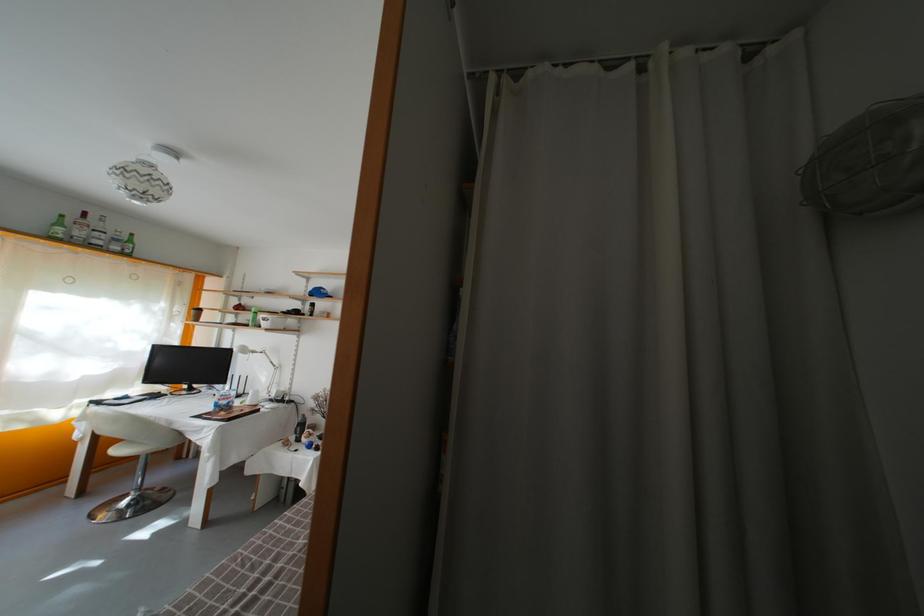
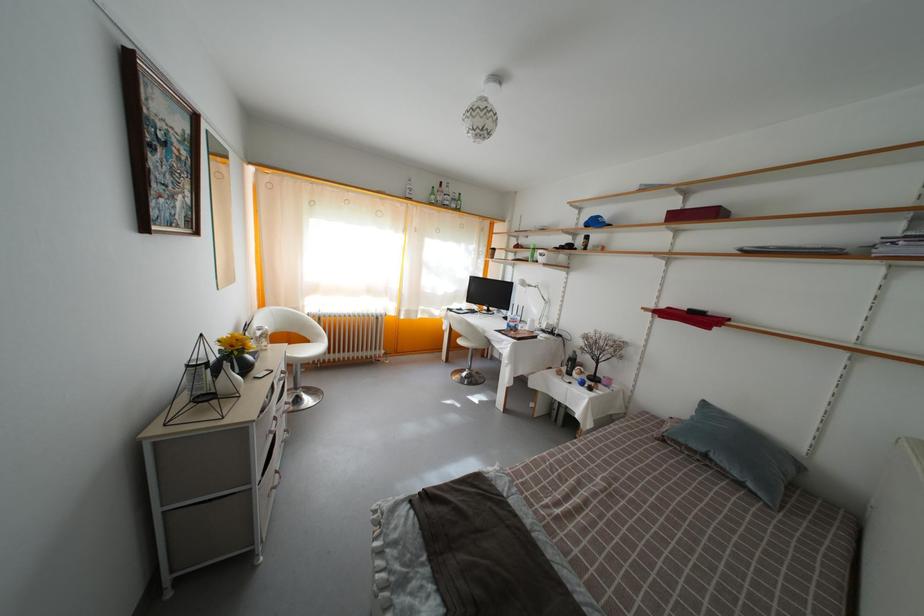
Locate, in the second image, the point that corresponds to pixel 311 293 in the first image.

(584, 225)